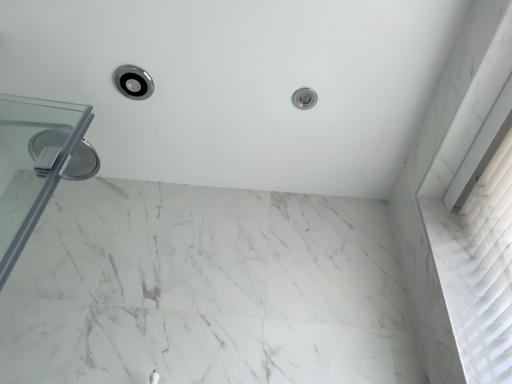
Question: Which direction should I rotate to face satin nickel showerhead at upper center, which appears as the 2th shower when viewed from the left, — up or down?

Choices:
 (A) up
 (B) down

Answer: (A)

Question: From the image's perspective, is polished chrome showerhead at upper left, the second shower when ordered from right to left, on top of satin nickel showerhead at upper center, the 1th shower positioned from the right?

Choices:
 (A) yes
 (B) no

Answer: (A)

Question: Is satin nickel showerhead at upper center, the 1th shower positioned from the right, a part of polished chrome showerhead at upper left, the second shower when ordered from right to left?

Choices:
 (A) no
 (B) yes

Answer: (A)

Question: From the image's perspective, is polished chrome showerhead at upper left, which is the first shower from left to right, below satin nickel showerhead at upper center, which appears as the 2th shower when viewed from the left?

Choices:
 (A) no
 (B) yes

Answer: (A)

Question: Is the depth of polished chrome showerhead at upper left, the second shower when ordered from right to left, less than that of satin nickel showerhead at upper center, which appears as the 2th shower when viewed from the left?

Choices:
 (A) no
 (B) yes

Answer: (B)

Question: Does polished chrome showerhead at upper left, the second shower when ordered from right to left, turn towards satin nickel showerhead at upper center, the 1th shower positioned from the right?

Choices:
 (A) yes
 (B) no

Answer: (B)

Question: From a real-world perspective, is polished chrome showerhead at upper left, the second shower when ordered from right to left, physically below satin nickel showerhead at upper center, which appears as the 2th shower when viewed from the left?

Choices:
 (A) no
 (B) yes

Answer: (B)

Question: From the image's perspective, is satin nickel showerhead at upper center, the 1th shower positioned from the right, over white marble bath at upper center?

Choices:
 (A) no
 (B) yes

Answer: (B)

Question: Considering the relative sizes of satin nickel showerhead at upper center, which appears as the 2th shower when viewed from the left, and white marble bath at upper center in the image provided, is satin nickel showerhead at upper center, which appears as the 2th shower when viewed from the left, bigger than white marble bath at upper center?

Choices:
 (A) yes
 (B) no

Answer: (B)

Question: Is satin nickel showerhead at upper center, which appears as the 2th shower when viewed from the left, located outside white marble bath at upper center?

Choices:
 (A) yes
 (B) no

Answer: (B)

Question: Is the depth of satin nickel showerhead at upper center, which appears as the 2th shower when viewed from the left, greater than that of white marble bath at upper center?

Choices:
 (A) yes
 (B) no

Answer: (A)

Question: Can you confirm if satin nickel showerhead at upper center, which appears as the 2th shower when viewed from the left, is positioned to the left of white marble bath at upper center?

Choices:
 (A) yes
 (B) no

Answer: (B)

Question: Does satin nickel showerhead at upper center, the 1th shower positioned from the right, have a greater width compared to white marble bath at upper center?

Choices:
 (A) no
 (B) yes

Answer: (A)

Question: From the image's perspective, is white marble bath at upper center located beneath satin nickel showerhead at upper center, the 1th shower positioned from the right?

Choices:
 (A) no
 (B) yes

Answer: (B)